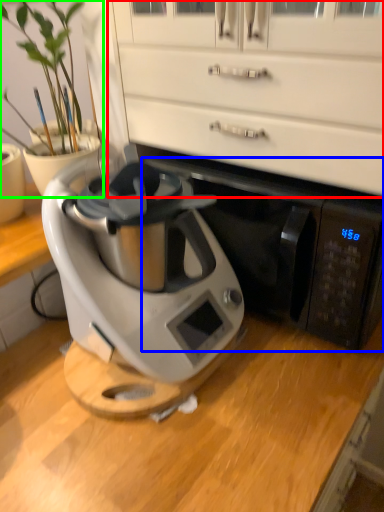
Question: Which object is the closest to the dresser (highlighted by a red box)? Choose among these: wide (highlighted by a blue box) or houseplant (highlighted by a green box).

Choices:
 (A) wide
 (B) houseplant

Answer: (A)